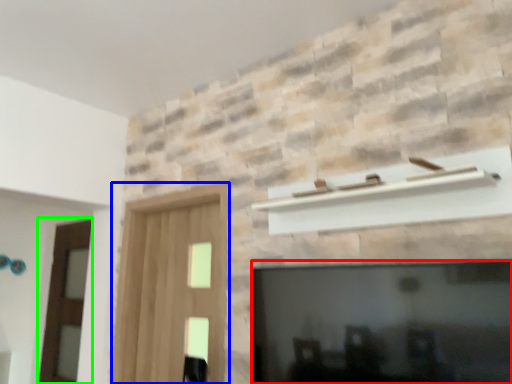
Question: Considering the real-world distances, which object is farthest from fireplace (highlighted by a red box)? screen door (highlighted by a blue box) or screen door (highlighted by a green box)?

Choices:
 (A) screen door
 (B) screen door

Answer: (B)